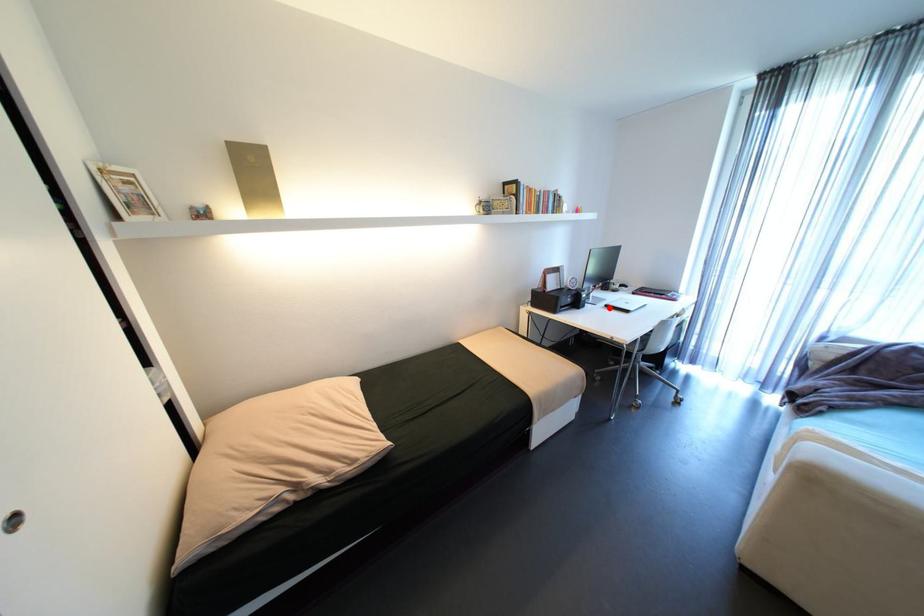
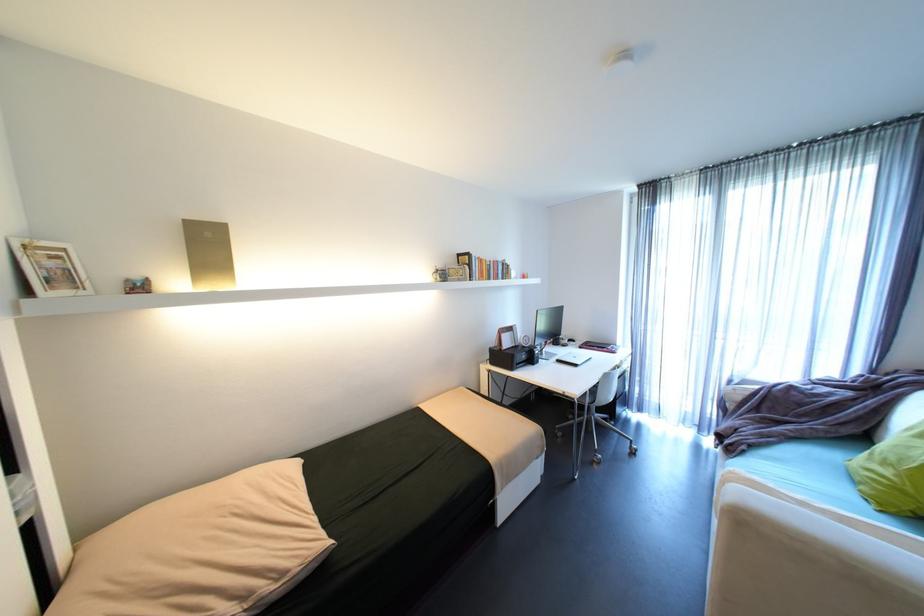
Locate, in the second image, the point that corresponds to the highlighted location in the first image.

(562, 363)